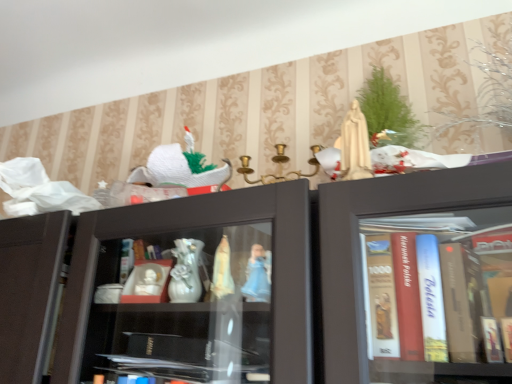
What do you see at coordinates (354, 145) in the screenshot? The height and width of the screenshot is (384, 512). I see `beige matte statue at upper center` at bounding box center [354, 145].

The image size is (512, 384). I want to click on beige matte statue at upper center, so click(354, 145).

What are the coordinates of `beige matte statue at upper center` in the screenshot? It's located at (354, 145).